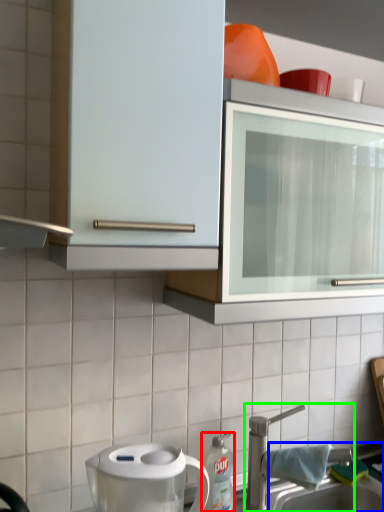
Question: Estimate the real-world distances between objects in this image. Which object is closer to kitchen appliance (highlighted by a red box), sink (highlighted by a blue box) or tap (highlighted by a green box)?

Choices:
 (A) sink
 (B) tap

Answer: (B)